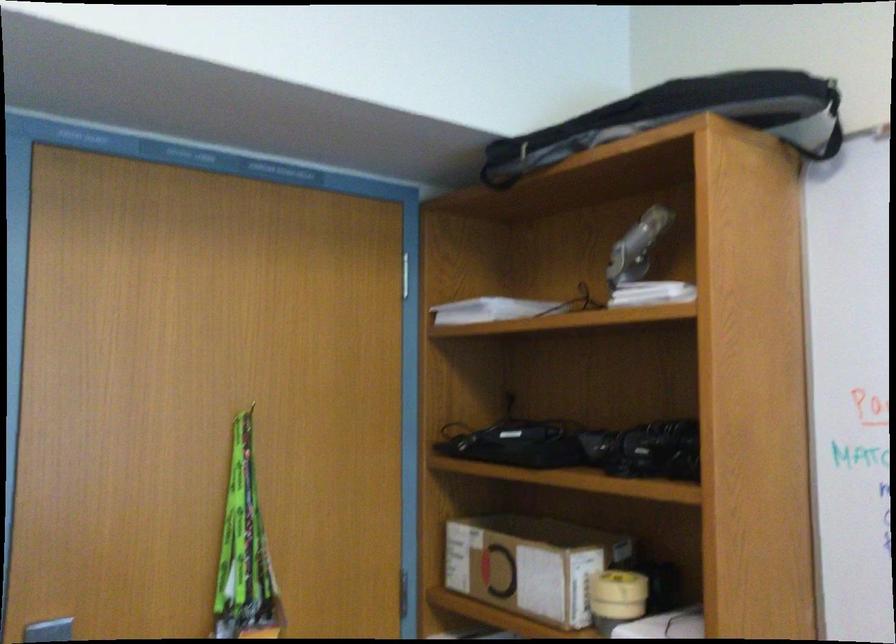
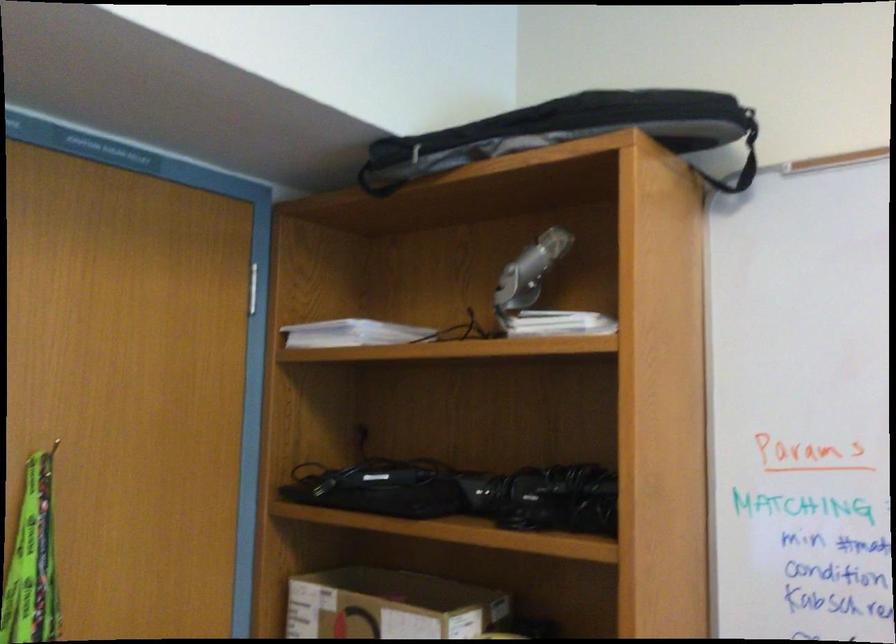
In the second image, find the point that corresponds to (x=633, y=247) in the first image.

(530, 270)